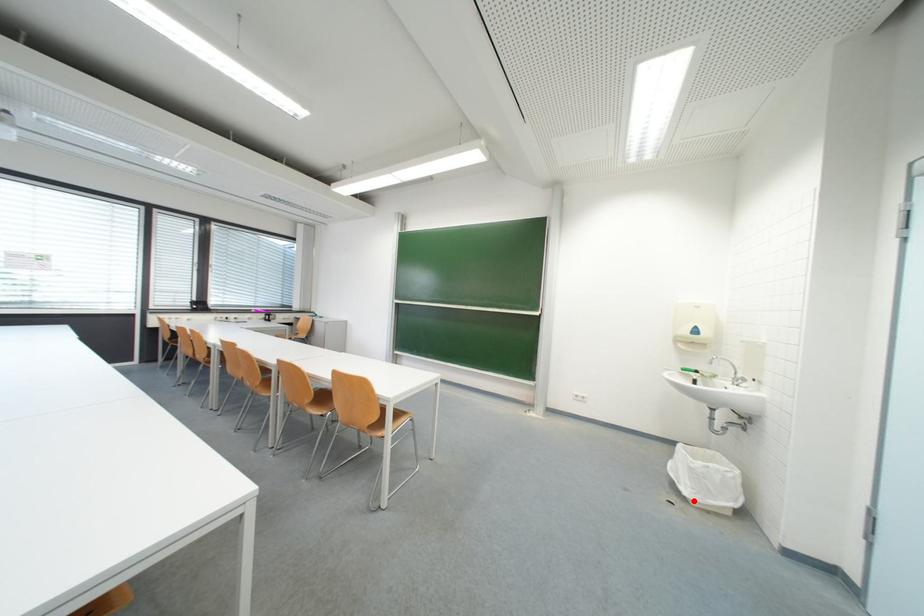
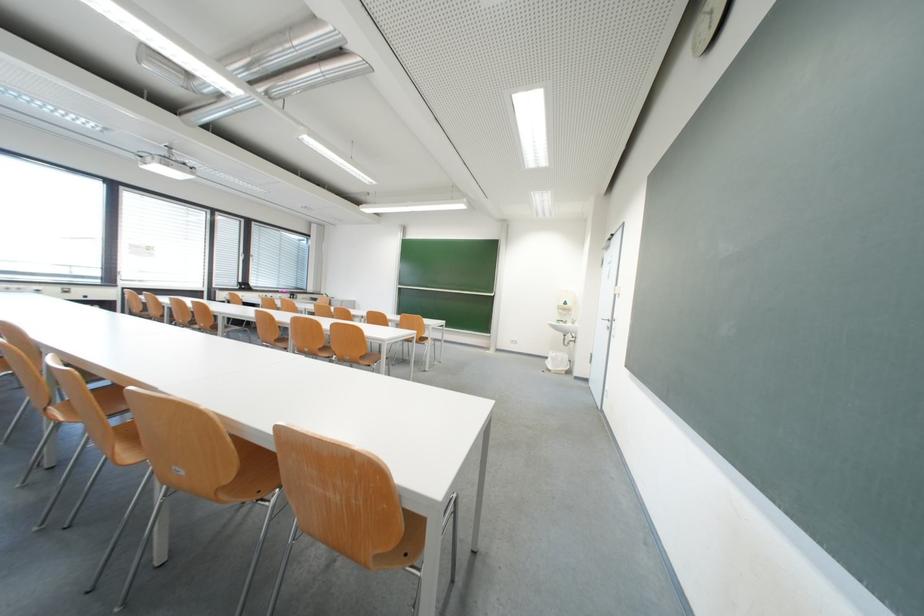
The point at the highlighted location is marked in the first image. Where is the corresponding point in the second image?

(558, 371)